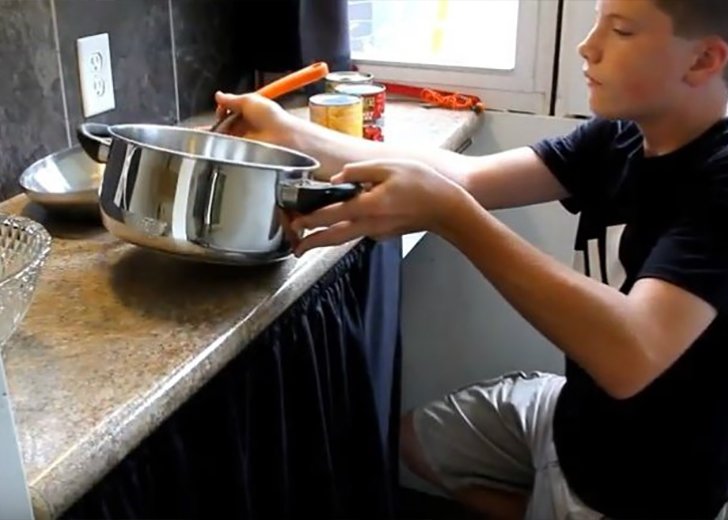
At what (x,y) coordinates should I click in order to perform the action: click on round metal pot. Please return your answer as a coordinate pair (x, y). This screenshot has height=520, width=728. Looking at the image, I should click on (218, 209).